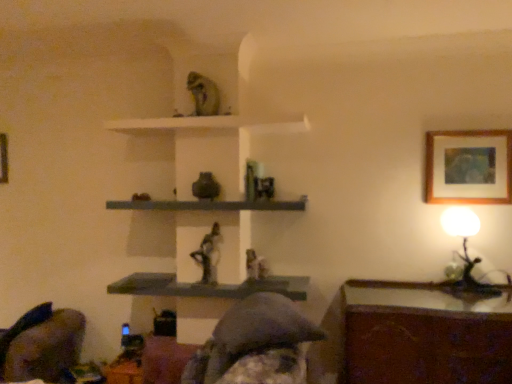
Question: In which direction should I rotate to look at white matte shelf at upper center, marked as the 3th shelf in a bottom-to-top arrangement?

Choices:
 (A) left
 (B) right

Answer: (A)

Question: Does wooden table at lower right have a greater height compared to matte gray shelf at center, positioned as the first shelf in bottom-to-top order?

Choices:
 (A) yes
 (B) no

Answer: (A)

Question: Is the position of wooden table at lower right more distant than that of matte gray shelf at center, positioned as the first shelf in bottom-to-top order?

Choices:
 (A) no
 (B) yes

Answer: (A)

Question: Is wooden table at lower right to the left of matte gray shelf at center, the 3th shelf when ordered from top to bottom, from the viewer's perspective?

Choices:
 (A) yes
 (B) no

Answer: (B)

Question: Is wooden table at lower right looking in the opposite direction of matte gray shelf at center, the 3th shelf when ordered from top to bottom?

Choices:
 (A) yes
 (B) no

Answer: (B)

Question: Are wooden table at lower right and matte gray shelf at center, positioned as the first shelf in bottom-to-top order, far apart?

Choices:
 (A) yes
 (B) no

Answer: (B)

Question: Can you confirm if wooden table at lower right is shorter than matte gray shelf at center, positioned as the first shelf in bottom-to-top order?

Choices:
 (A) no
 (B) yes

Answer: (A)

Question: Is wooden table at lower right at the back of velvet dark gray swivel chair at lower left?

Choices:
 (A) yes
 (B) no

Answer: (B)

Question: Is velvet dark gray swivel chair at lower left to the right of wooden table at lower right from the viewer's perspective?

Choices:
 (A) no
 (B) yes

Answer: (A)

Question: Is velvet dark gray swivel chair at lower left outside wooden table at lower right?

Choices:
 (A) no
 (B) yes

Answer: (B)

Question: Is velvet dark gray swivel chair at lower left positioned far away from wooden table at lower right?

Choices:
 (A) yes
 (B) no

Answer: (A)

Question: Is velvet dark gray swivel chair at lower left next to wooden table at lower right?

Choices:
 (A) no
 (B) yes

Answer: (A)

Question: Is wooden table at lower right located within velvet dark gray swivel chair at lower left?

Choices:
 (A) yes
 (B) no

Answer: (B)

Question: Is matte gray statue at center, the 3th person when ordered from back to front, to the left of matte gray shelf at center, positioned as the first shelf in bottom-to-top order, from the viewer's perspective?

Choices:
 (A) yes
 (B) no

Answer: (B)